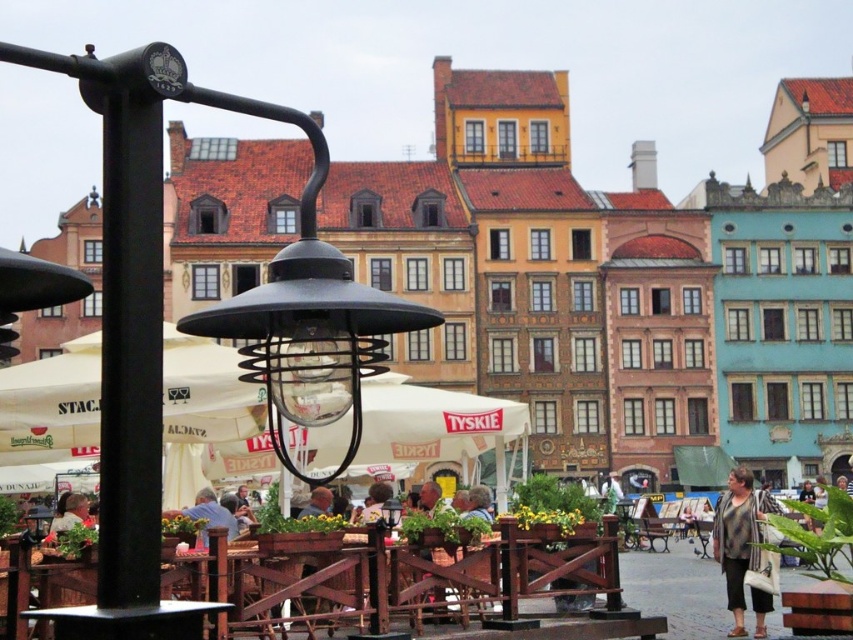
Who is more forward, (126, 212) or (726, 508)?

Point (126, 212)

Can you confirm if black matte lamp post at left is positioned above striped fabric shirt at lower right?

Yes.

What do you see at coordinates (190, 321) in the screenshot? Image resolution: width=853 pixels, height=640 pixels. I see `black matte lamp post at left` at bounding box center [190, 321].

The height and width of the screenshot is (640, 853). What are the coordinates of `black matte lamp post at left` in the screenshot? It's located at (190, 321).

Who is shorter, black matte lamp post at left or wooden table at lower left?

Standing shorter between the two is wooden table at lower left.

Does black matte lamp post at left appear on the right side of wooden table at lower left?

In fact, black matte lamp post at left is to the left of wooden table at lower left.

Describe the element at coordinates (190, 321) in the screenshot. I see `black matte lamp post at left` at that location.

You are a GUI agent. You are given a task and a screenshot of the screen. Output one action in this format:
    pyautogui.click(x=<x>, y=<y>)
    Task: Click on the black matte lamp post at left
    This screenshot has width=853, height=640.
    Given the screenshot: What is the action you would take?
    pyautogui.click(x=190, y=321)

Which is in front, point (115, 172) or point (747, 532)?

Positioned in front is point (115, 172).

Between black matte pole at left and striped fabric shirt at lower right, which one is positioned lower?

striped fabric shirt at lower right is below.

Image resolution: width=853 pixels, height=640 pixels. In order to click on black matte pole at left in this screenshot , I will do `click(131, 348)`.